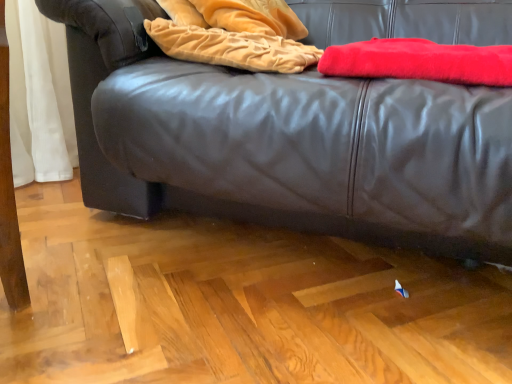
Question: Does red fuzzy blanket at upper right, the 2th blanket when ordered from left to right, have a smaller size compared to velvet gold blanket at upper center, which appears as the 1th blanket when viewed from the left?

Choices:
 (A) no
 (B) yes

Answer: (A)

Question: Is red fuzzy blanket at upper right, the 2th blanket when ordered from left to right, positioned with its back to velvet gold blanket at upper center, which is the second blanket in right-to-left order?

Choices:
 (A) no
 (B) yes

Answer: (A)

Question: Considering the relative sizes of red fuzzy blanket at upper right, the 1th blanket from the right, and velvet gold blanket at upper center, which appears as the 1th blanket when viewed from the left, in the image provided, is red fuzzy blanket at upper right, the 1th blanket from the right, shorter than velvet gold blanket at upper center, which appears as the 1th blanket when viewed from the left,?

Choices:
 (A) no
 (B) yes

Answer: (B)

Question: Is red fuzzy blanket at upper right, the 1th blanket from the right, to the left of velvet gold blanket at upper center, which is the second blanket in right-to-left order, from the viewer's perspective?

Choices:
 (A) yes
 (B) no

Answer: (B)

Question: From a real-world perspective, is red fuzzy blanket at upper right, the 2th blanket when ordered from left to right, physically above velvet gold blanket at upper center, which is the second blanket in right-to-left order?

Choices:
 (A) no
 (B) yes

Answer: (A)

Question: Considering the positions of point (260, 66) and point (375, 69), is point (260, 66) closer or farther from the camera than point (375, 69)?

Choices:
 (A) closer
 (B) farther

Answer: (B)

Question: From the image's perspective, is velvet gold blanket at upper center, which is the second blanket in right-to-left order, above or below red fuzzy blanket at upper right, the 2th blanket when ordered from left to right?

Choices:
 (A) above
 (B) below

Answer: (A)

Question: Considering the positions of velvet gold blanket at upper center, which is the second blanket in right-to-left order, and red fuzzy blanket at upper right, the 1th blanket from the right, in the image, is velvet gold blanket at upper center, which is the second blanket in right-to-left order, taller or shorter than red fuzzy blanket at upper right, the 1th blanket from the right,?

Choices:
 (A) tall
 (B) short

Answer: (A)

Question: Choose the correct answer: Is velvet gold blanket at upper center, which appears as the 1th blanket when viewed from the left, inside red fuzzy blanket at upper right, the 1th blanket from the right, or outside it?

Choices:
 (A) inside
 (B) outside

Answer: (B)

Question: Considering the positions of velvet gold blanket at upper center, which appears as the 1th blanket when viewed from the left, and black leather couch at center in the image, is velvet gold blanket at upper center, which appears as the 1th blanket when viewed from the left, wider or thinner than black leather couch at center?

Choices:
 (A) thin
 (B) wide

Answer: (A)

Question: From the image's perspective, is velvet gold blanket at upper center, which is the second blanket in right-to-left order, located above or below black leather couch at center?

Choices:
 (A) above
 (B) below

Answer: (A)

Question: In terms of size, does velvet gold blanket at upper center, which is the second blanket in right-to-left order, appear bigger or smaller than black leather couch at center?

Choices:
 (A) small
 (B) big

Answer: (A)

Question: Is velvet gold blanket at upper center, which is the second blanket in right-to-left order, to the left or to the right of black leather couch at center in the image?

Choices:
 (A) left
 (B) right

Answer: (A)

Question: Considering the positions of black leather couch at center and velvet gold blanket at upper center, which is the second blanket in right-to-left order, in the image, is black leather couch at center taller or shorter than velvet gold blanket at upper center, which is the second blanket in right-to-left order,?

Choices:
 (A) short
 (B) tall

Answer: (B)

Question: Based on their sizes in the image, would you say black leather couch at center is bigger or smaller than velvet gold blanket at upper center, which is the second blanket in right-to-left order?

Choices:
 (A) small
 (B) big

Answer: (B)